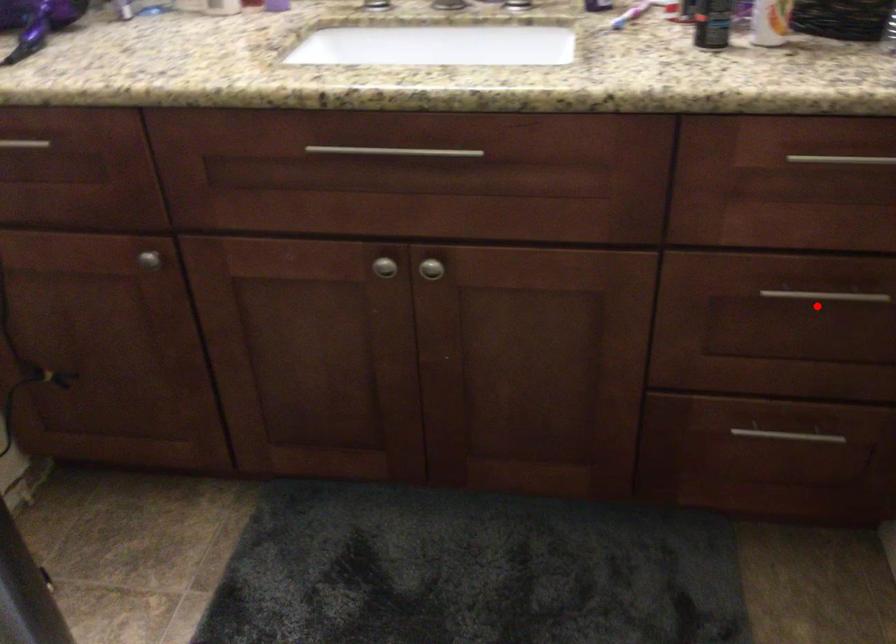
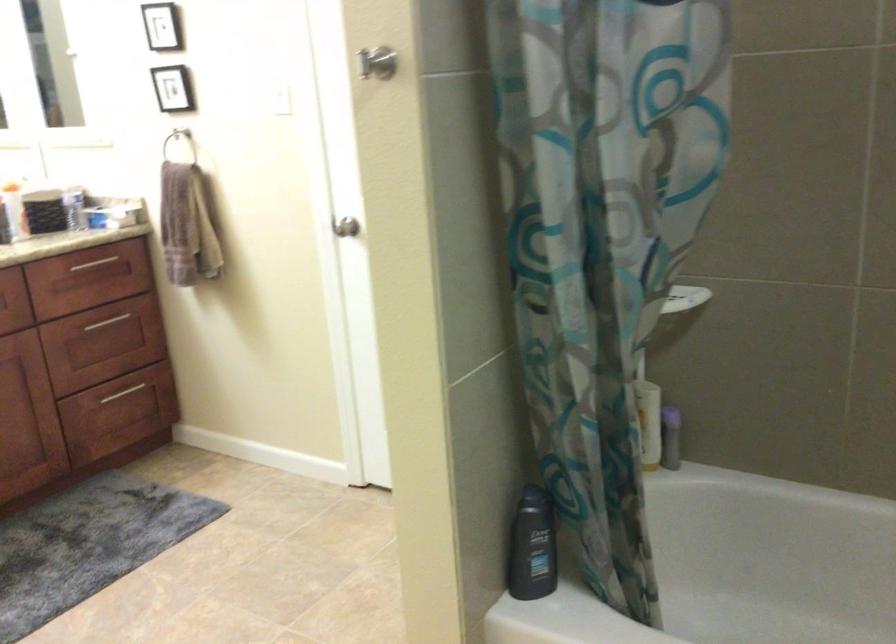
Question: I am providing you with two images of the same scene from different viewpoints. Given a red point in image1, look at the same physical point in image2. Is it:

Choices:
 (A) Closer to the viewpoint
 (B) Farther from the viewpoint

Answer: (B)